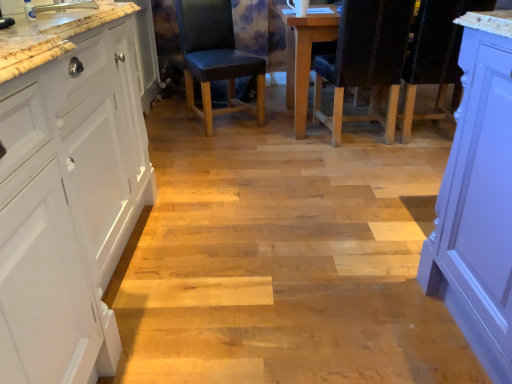
Where is `vacant space behind white matte cabinet at left`? vacant space behind white matte cabinet at left is located at coordinates (209, 167).